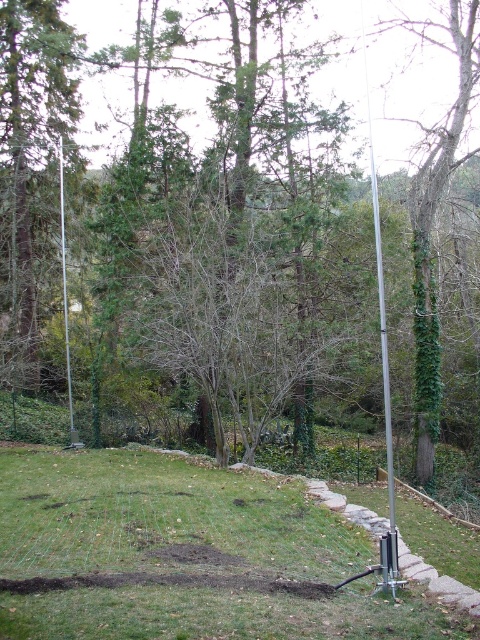
Does green grass at center have a smaller size compared to green ivy-covered tree at right?

Indeed, green grass at center has a smaller size compared to green ivy-covered tree at right.

The width and height of the screenshot is (480, 640). What are the coordinates of `green grass at center` in the screenshot? It's located at (188, 554).

Does green grass at center appear under silver metallic pole at right?

→ Yes, green grass at center is below silver metallic pole at right.

Does green grass at center have a lesser width compared to silver metallic pole at right?

Incorrect, green grass at center's width is not less than silver metallic pole at right's.

Does point (193, 500) lie behind point (389, 426)?

Yes, point (193, 500) is farther from viewer.

Find the location of a particular element. green grass at center is located at coordinates [x=188, y=554].

Who is shorter, green grass at center or silver metallic pole at center?

green grass at center is shorter.

In the scene shown: Which is more to the left, green grass at center or silver metallic pole at center?

Positioned to the left is silver metallic pole at center.

The image size is (480, 640). I want to click on green grass at center, so click(x=188, y=554).